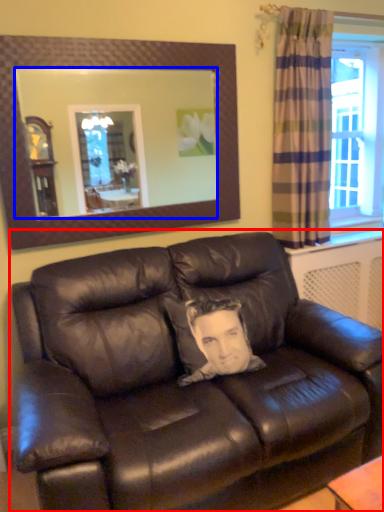
Question: Among these objects, which one is nearest to the camera, studio couch (highlighted by a red box) or mirror (highlighted by a blue box)?

Choices:
 (A) studio couch
 (B) mirror

Answer: (A)